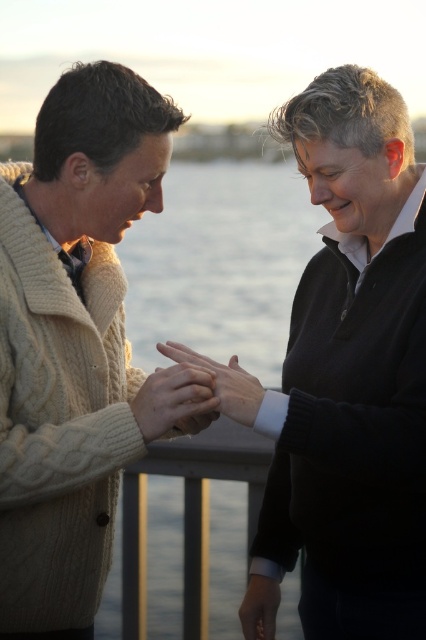
You are an artist trying to sketch this scene. You notice the matte beige sweater at center and the matte beige hand at center. Which object is positioned lower in the image?

The matte beige sweater at center is located below the matte beige hand at center, so the sweater is positioned lower than the hand.

You are standing in the scene and want to move from the point closer to you to the farther point. Which path would you take between the two points, point (227, 378) and point (247, 628)?

You should move from point (227, 378) to point (247, 628) because point (227, 378) is closer to the viewer and the other is farther away.